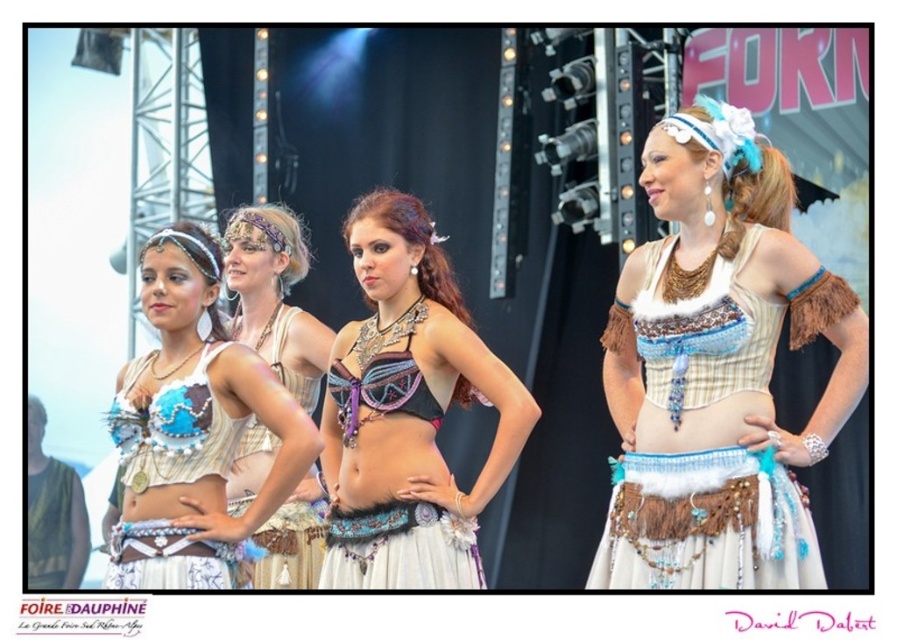
Consider the image. Between shiny purple fabric bra at center and matte blue fabric bra at left, which one appears on the right side from the viewer's perspective?

shiny purple fabric bra at center

Can you confirm if shiny purple fabric bra at center is taller than matte blue fabric bra at left?

Yes.

Locate an element on the screen. Image resolution: width=897 pixels, height=640 pixels. shiny purple fabric bra at center is located at coordinates (407, 412).

Where is `shiny purple fabric bra at center`? The height and width of the screenshot is (640, 897). shiny purple fabric bra at center is located at coordinates (407, 412).

Which of these two, beige textured top at center or matte beige bra at center, stands shorter?

beige textured top at center is shorter.

The image size is (897, 640). What do you see at coordinates (718, 369) in the screenshot? I see `beige textured top at center` at bounding box center [718, 369].

Identify the location of beige textured top at center. (718, 369).

Who is more distant from viewer, (246, 384) or (199, 385)?

The point (246, 384) is more distant.

Between point (167, 582) and point (181, 445), which one is positioned in front?

Point (167, 582)

Locate an element on the screen. This screenshot has height=640, width=897. matte white fabric at center is located at coordinates (194, 429).